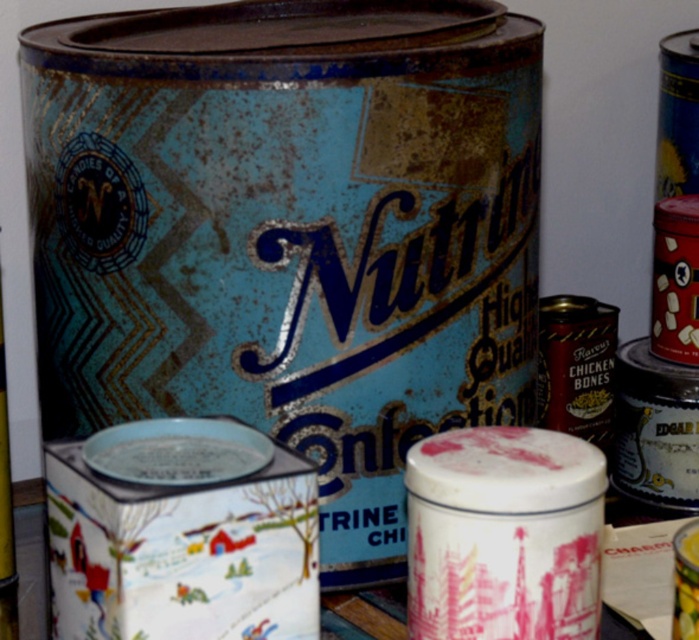
Question: Is metallic gold beer can at right closer to the viewer compared to metallic gold beer can at upper right?

Choices:
 (A) yes
 (B) no

Answer: (B)

Question: Which of the following is the closest to the observer?

Choices:
 (A) shiny metallic can at right
 (B) shiny gold can at center

Answer: (B)

Question: Does shiny gold can at center come in front of metallic gold beer can at upper right?

Choices:
 (A) no
 (B) yes

Answer: (A)

Question: Which object appears closest to the camera in this image?

Choices:
 (A) rusty metal can at center
 (B) shiny gold can at center
 (C) metallic gold beer can at upper right
 (D) metallic gold beer can at right

Answer: (C)

Question: Which point is closer to the camera?

Choices:
 (A) shiny gold can at center
 (B) metallic gold beer can at right

Answer: (A)

Question: Does metallic gold beer can at right appear under metallic gold beer can at upper right?

Choices:
 (A) no
 (B) yes

Answer: (A)